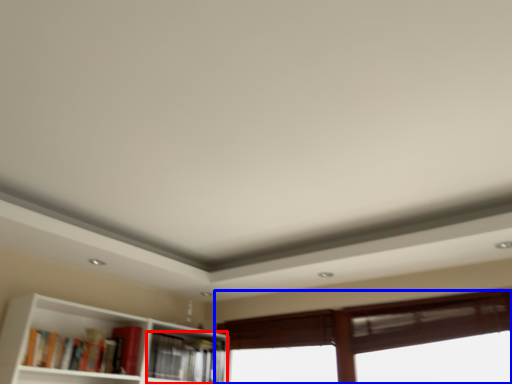
Question: Which object appears closest to the camera in this image, book (highlighted by a red box) or window (highlighted by a blue box)?

Choices:
 (A) book
 (B) window

Answer: (B)